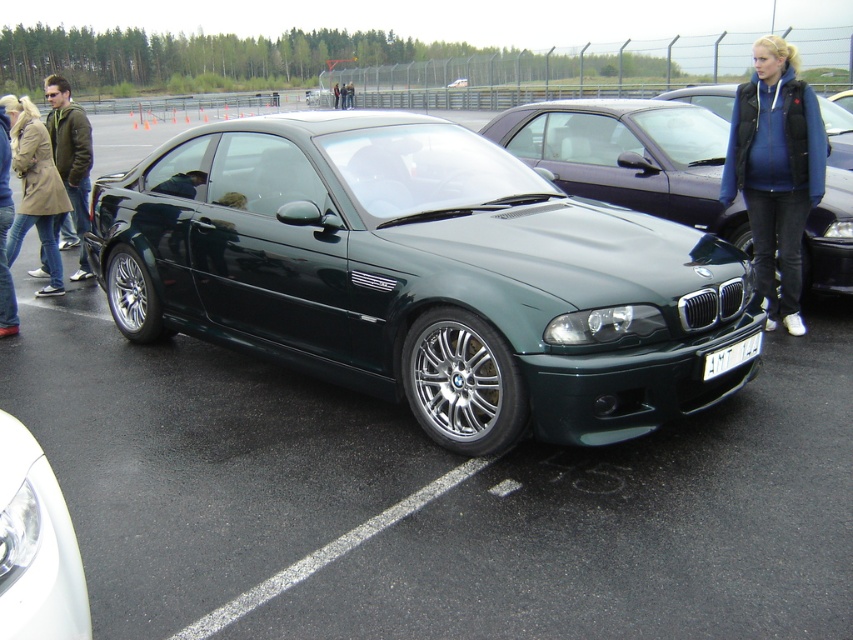
You are standing at the edge of a parking lot near a racetrack and see the green metallic car at center. If you want to take a photo of it from a distance where the car fills the frame without being too close, would 5.55 meters be a suitable distance?

The green metallic car at center is 5.55 meters away from the camera, so this distance should be suitable for taking a photo where the car fills the frame without being too close.